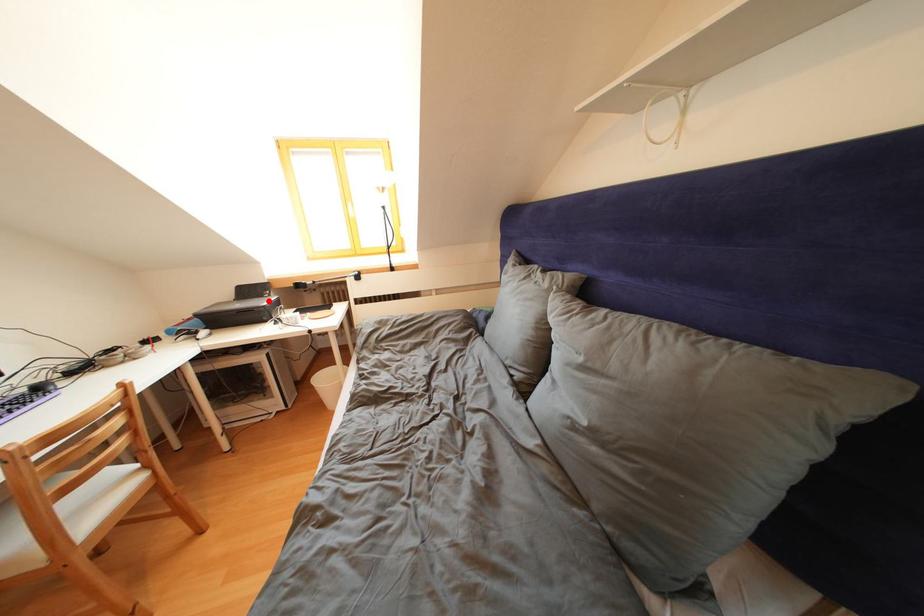
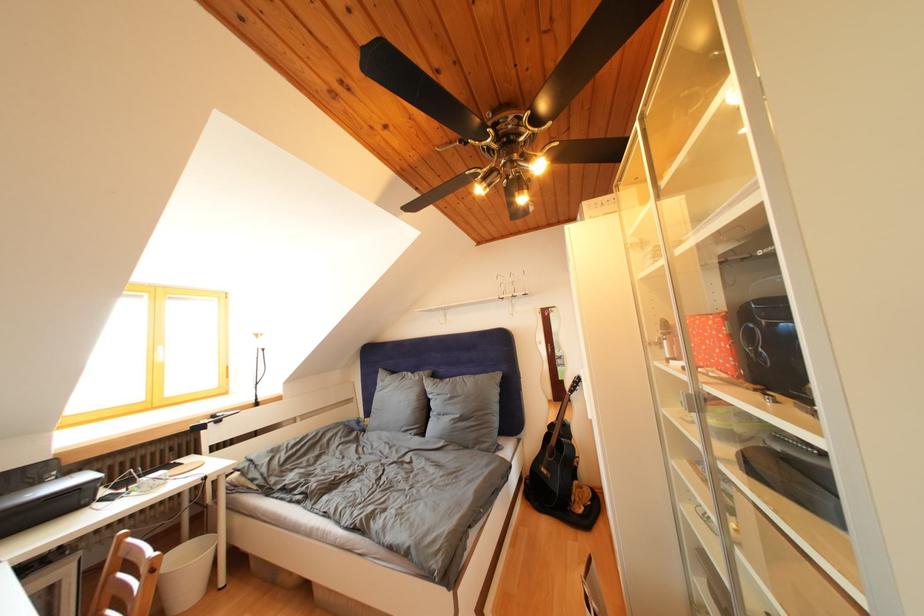
Where in the second image is the point corresponding to the highlighted location from the first image?

(44, 488)